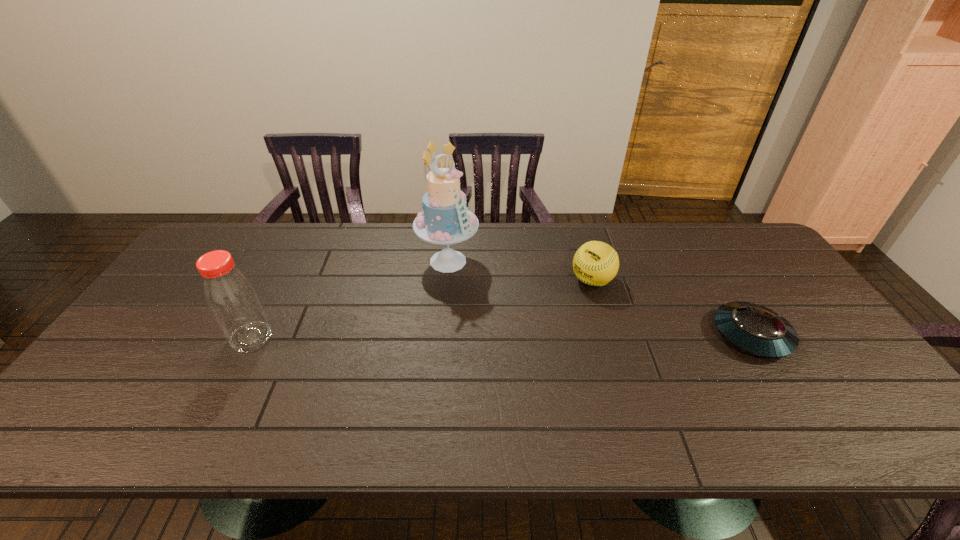
Identify the location of vacant spot on the desktop that is between the second tallest object and the saucer and is positioned on the logo side of the second object from right to left. (519, 336).

You are a GUI agent. You are given a task and a screenshot of the screen. Output one action in this format:
    pyautogui.click(x=<x>, y=<y>)
    Task: Click on the vacant space on the desktop that is between the leftmost object and the saucer and is positioned with a ladder on the side of the tallest object
    Image resolution: width=960 pixels, height=540 pixels.
    Given the screenshot: What is the action you would take?
    pyautogui.click(x=483, y=336)